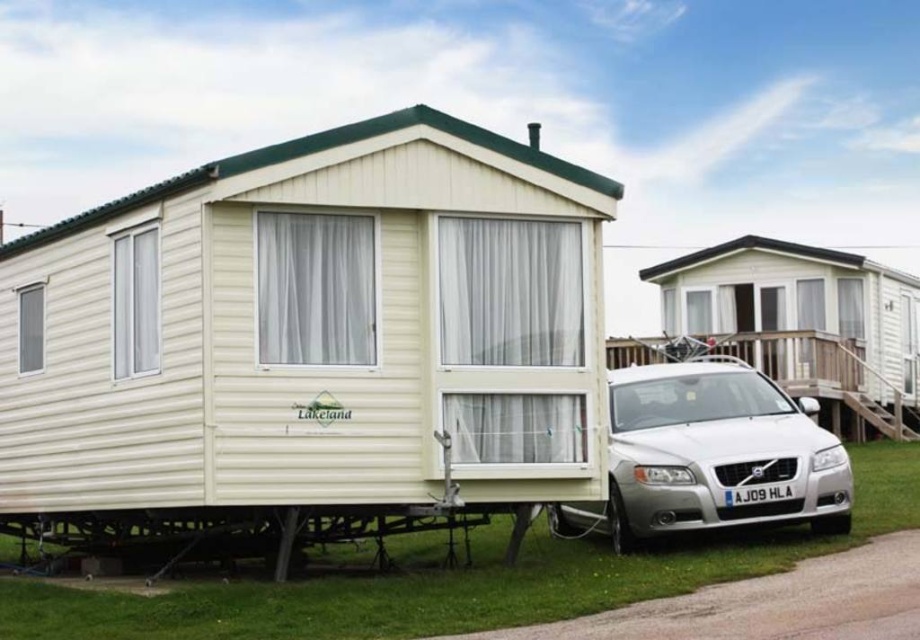
Can you confirm if beige vinyl camper at center is thinner than silver metallic car at lower right?

Yes.

Can you confirm if beige vinyl camper at center is shorter than silver metallic car at lower right?

Indeed, beige vinyl camper at center has a lesser height compared to silver metallic car at lower right.

I want to click on beige vinyl camper at center, so click(309, 339).